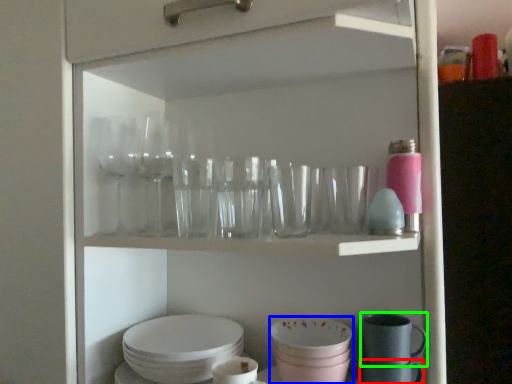
Question: Which is farther away from tableware (highlighted by a red box)? tableware (highlighted by a blue box) or tableware (highlighted by a green box)?

Choices:
 (A) tableware
 (B) tableware

Answer: (A)